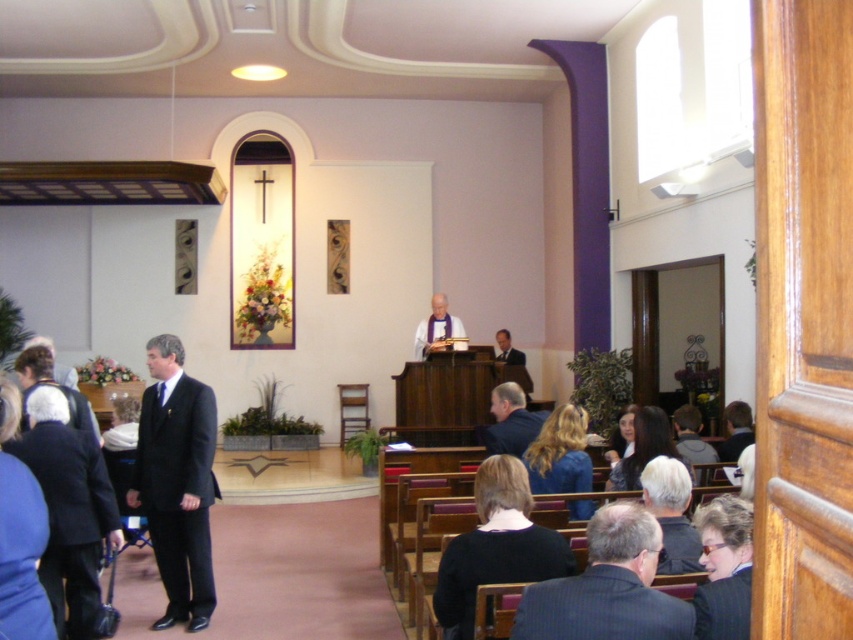
Question: Which of the following is the farthest from the observer?

Choices:
 (A) matte black suit at left
 (B) dark gray suit at center
 (C) dark brown suit at lower right

Answer: (C)

Question: Does dark gray suit at center appear on the left side of matte white robe at center?

Choices:
 (A) yes
 (B) no

Answer: (B)

Question: Does dark gray suit at center appear under gray hair at lower right?

Choices:
 (A) no
 (B) yes

Answer: (B)

Question: Which object is farther from the camera taking this photo?

Choices:
 (A) matte white robe at center
 (B) gray hair at lower right
 (C) dark suit at lower left

Answer: (A)

Question: Which is nearer to the dark blue suit at center?

Choices:
 (A) matte black suit at left
 (B) dark brown suit at lower right

Answer: (B)

Question: Where is gray hair at lower right located in relation to dark suit at center in the image?

Choices:
 (A) right
 (B) left

Answer: (B)